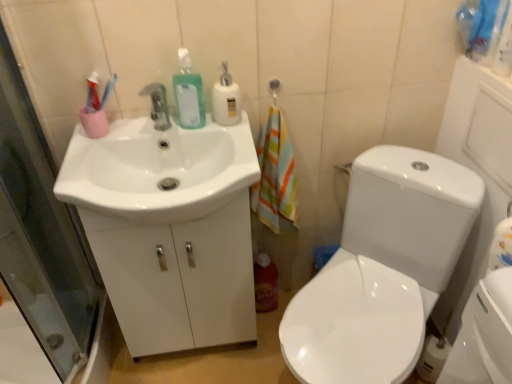
Question: From a real-world perspective, is white glossy sink at left positioned over translucent plastic bottle at lower center, acting as the first cleaning product starting from the bottom, based on gravity?

Choices:
 (A) yes
 (B) no

Answer: (A)

Question: Is translucent plastic bottle at lower center, the third cleaning product positioned from the left, at the back of white glossy sink at left?

Choices:
 (A) no
 (B) yes

Answer: (A)

Question: Is white glossy sink at left shorter than translucent plastic bottle at lower center, marked as the 3th cleaning product in a top-to-bottom arrangement?

Choices:
 (A) yes
 (B) no

Answer: (A)

Question: From the image's perspective, is white glossy sink at left located beneath translucent plastic bottle at lower center, which is counted as the first cleaning product, starting from the right?

Choices:
 (A) no
 (B) yes

Answer: (A)

Question: Are white glossy sink at left and translucent plastic bottle at lower center, marked as the 1th cleaning product in a back-to-front arrangement, far apart?

Choices:
 (A) yes
 (B) no

Answer: (B)

Question: Can you confirm if white glossy sink at left is wider than translucent plastic bottle at lower center, marked as the 1th cleaning product in a back-to-front arrangement?

Choices:
 (A) no
 (B) yes

Answer: (B)

Question: Can you confirm if green matte liquid soap at upper center, the third cleaning product in the bottom-to-top sequence, is shorter than translucent plastic bottle at lower center, acting as the first cleaning product starting from the bottom?

Choices:
 (A) no
 (B) yes

Answer: (B)

Question: Can you confirm if green matte liquid soap at upper center, the third cleaning product in the bottom-to-top sequence, is thinner than translucent plastic bottle at lower center, marked as the 3th cleaning product in a top-to-bottom arrangement?

Choices:
 (A) no
 (B) yes

Answer: (B)

Question: Does green matte liquid soap at upper center, the third cleaning product in the right-to-left sequence, lie in front of translucent plastic bottle at lower center, placed as the third cleaning product when sorted from front to back?

Choices:
 (A) no
 (B) yes

Answer: (B)

Question: Is green matte liquid soap at upper center, which is the first cleaning product from front to back, at the left side of translucent plastic bottle at lower center, the third cleaning product positioned from the left?

Choices:
 (A) yes
 (B) no

Answer: (A)

Question: Can you confirm if green matte liquid soap at upper center, the 1th cleaning product positioned from the left, is bigger than translucent plastic bottle at lower center, marked as the 1th cleaning product in a back-to-front arrangement?

Choices:
 (A) yes
 (B) no

Answer: (B)

Question: Is green matte liquid soap at upper center, which is the first cleaning product from front to back, facing away from translucent plastic bottle at lower center, marked as the 3th cleaning product in a top-to-bottom arrangement?

Choices:
 (A) yes
 (B) no

Answer: (B)

Question: Considering the relative positions of white glossy toilet at right and matte silver faucet at center in the image provided, is white glossy toilet at right to the left of matte silver faucet at center from the viewer's perspective?

Choices:
 (A) no
 (B) yes

Answer: (A)